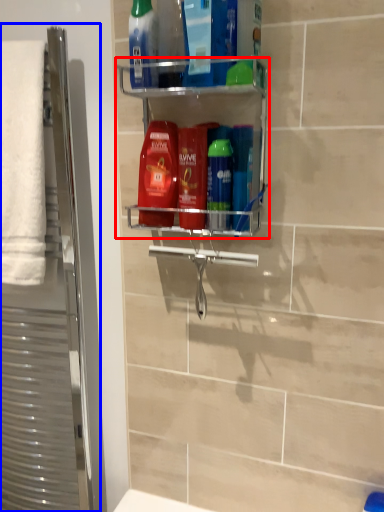
Question: Which of the following is the farthest to the observer, shelf (highlighted by a red box) or screen door (highlighted by a blue box)?

Choices:
 (A) shelf
 (B) screen door

Answer: (B)